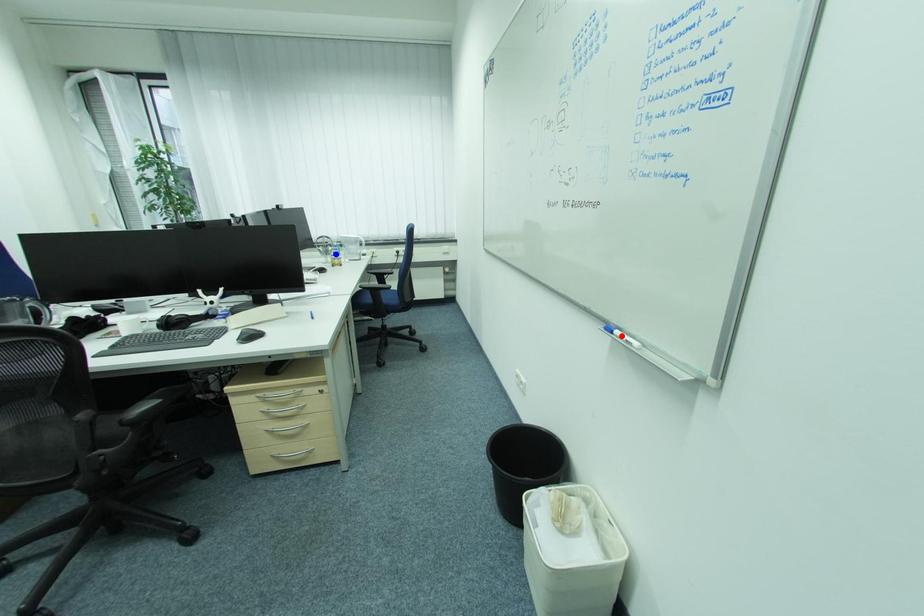
Question: Two points are marked on the image. Which point is closer to the camera?

Choices:
 (A) Blue point is closer.
 (B) Red point is closer.

Answer: (B)